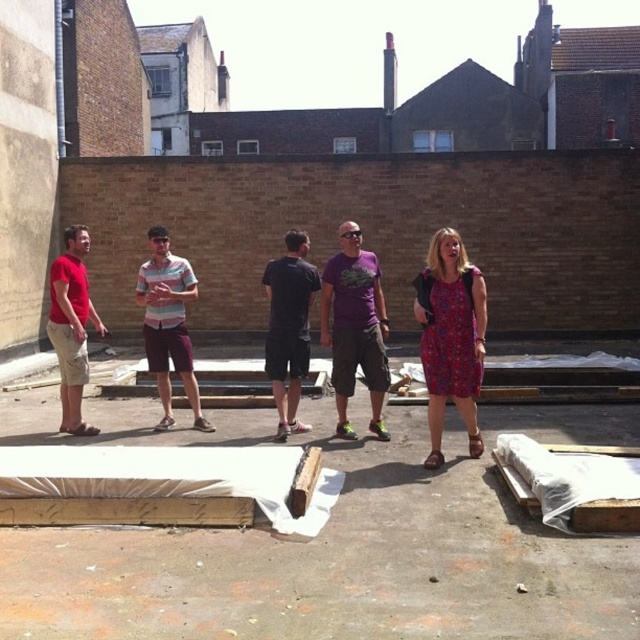
Question: Among these points, which one is farthest from the camera?

Choices:
 (A) (60, 280)
 (B) (301, 323)
 (C) (179, 353)
 (D) (368, 321)

Answer: (C)

Question: Which point is closer to the camera taking this photo?

Choices:
 (A) (56, 301)
 (B) (353, 436)
 (C) (298, 317)
 (D) (138, 300)

Answer: (B)

Question: Can you confirm if dress at center is thinner than striped cotton shirt at center?

Choices:
 (A) no
 (B) yes

Answer: (B)

Question: Observing the image, what is the correct spatial positioning of striped cotton shirt at center in reference to black matte shorts at center?

Choices:
 (A) above
 (B) below

Answer: (A)

Question: Estimate the real-world distances between objects in this image. Which object is farther from the dress at center?

Choices:
 (A) matte red t-shirt at left
 (B) black matte shorts at center

Answer: (A)

Question: Can you confirm if striped cotton shirt at center is thinner than matte red t-shirt at left?

Choices:
 (A) yes
 (B) no

Answer: (B)